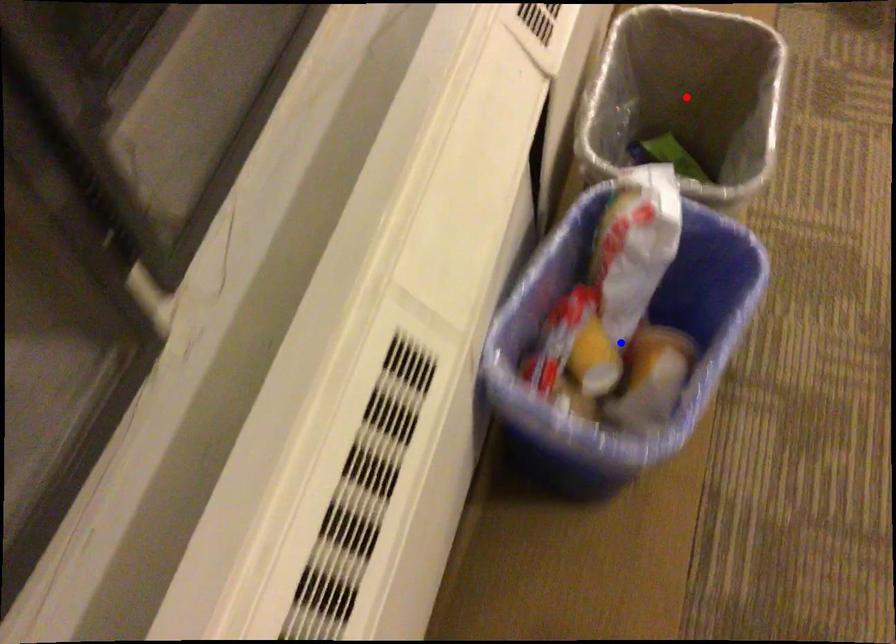
Question: Which of the two points in the image is closer to the camera?

Choices:
 (A) Blue point is closer.
 (B) Red point is closer.

Answer: (A)